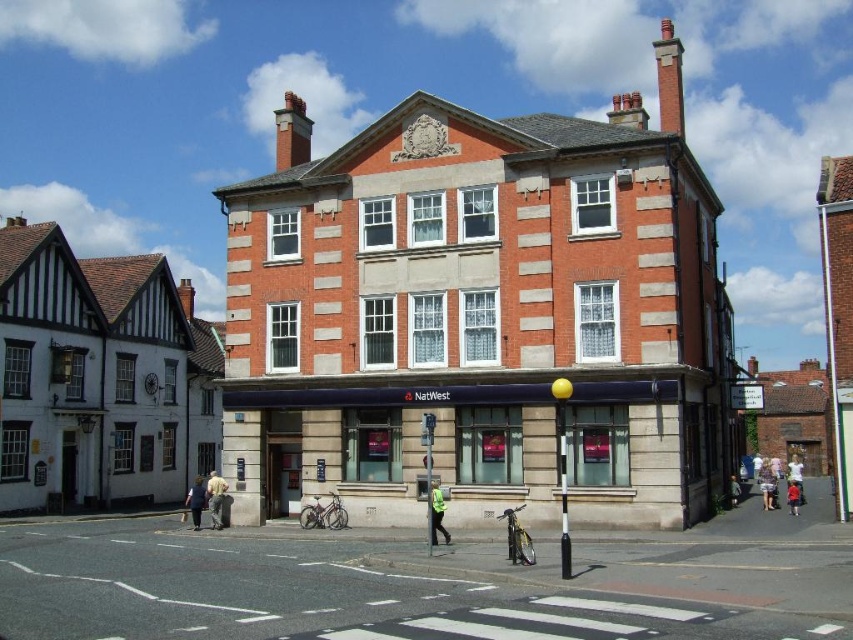
You are standing in the street scene described. You need to place a 10 feet long banner between the light blue denim jacket at center and the dark blue jeans at lower right. Is there enough space between them to place the banner horizontally?

The distance between the light blue denim jacket at center and the dark blue jeans at lower right is 13.91 feet. Since the banner is 10 feet long, there is sufficient space to place it horizontally between them.

You are a person standing in front of the NatWest building and see the light blue denim jacket at center and the dark blue jeans at lower right. Which object is taller?

The light blue denim jacket at center is taller than the dark blue jeans at lower right.

You are a photographer standing in front of the NatWest building entrance. You notice a light brown fabric dress at lower right and dark blue jeans at lower right. Which clothing item is wider?

The light brown fabric dress at lower right is wider than the dark blue jeans at lower right, as its width surpasses that of the jeans.